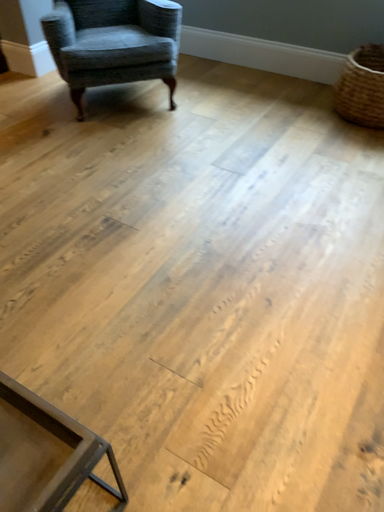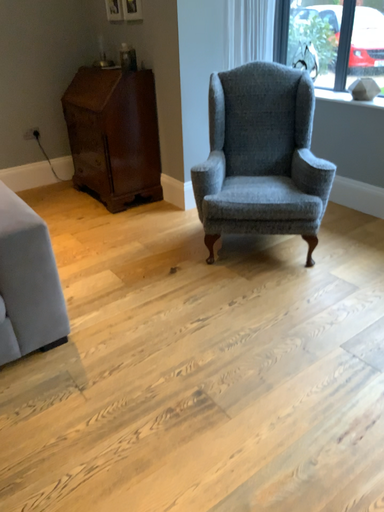
Question: How did the camera likely rotate when shooting the video?

Choices:
 (A) rotated left
 (B) rotated right

Answer: (A)